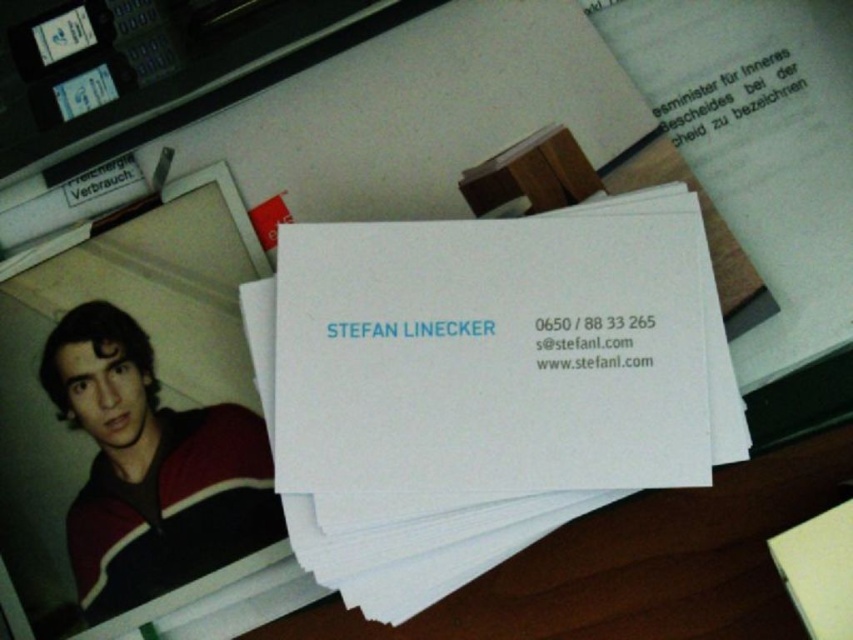
Question: Estimate the real-world distances between objects in this image. Which object is closer to the striped sweater at lower left?

Choices:
 (A) white matte business card at center
 (B) white paper at center

Answer: (A)

Question: Which point is farther to the camera?

Choices:
 (A) (631, 502)
 (B) (148, 376)

Answer: (A)

Question: Does white paper at center have a smaller size compared to striped sweater at lower left?

Choices:
 (A) yes
 (B) no

Answer: (B)

Question: Is white paper at center wider than striped sweater at lower left?

Choices:
 (A) yes
 (B) no

Answer: (A)

Question: Which object is closer to the camera taking this photo?

Choices:
 (A) white matte business card at center
 (B) white paper at center

Answer: (A)

Question: Can you confirm if white paper at center is smaller than striped sweater at lower left?

Choices:
 (A) yes
 (B) no

Answer: (B)